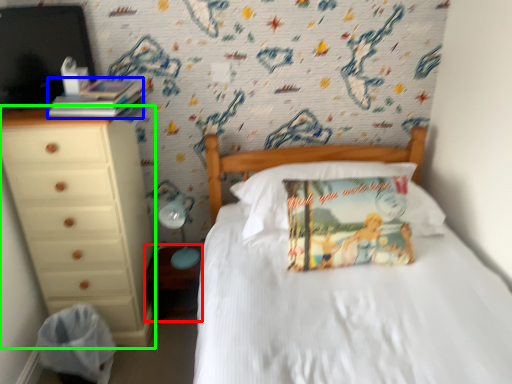
Question: Which object is positioned farthest from nightstand (highlighted by a red box)? Select from book (highlighted by a blue box) and chest of drawers (highlighted by a green box).

Choices:
 (A) book
 (B) chest of drawers

Answer: (A)